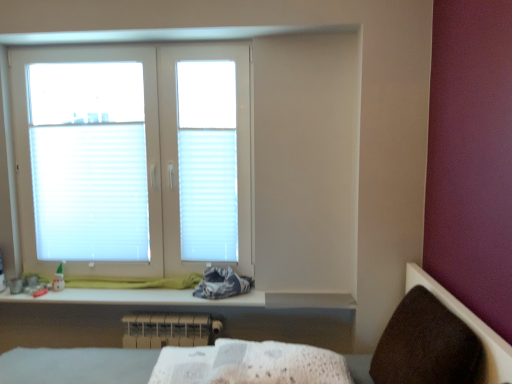
Locate an element on the screen. free point above white glossy changing table at lower center (from a real-world perspective) is located at coordinates (159, 292).